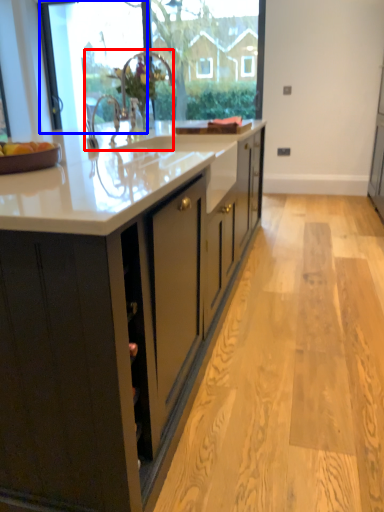
Question: Which point is further to the camera, sink (highlighted by a red box) or glass door (highlighted by a blue box)?

Choices:
 (A) sink
 (B) glass door

Answer: (B)